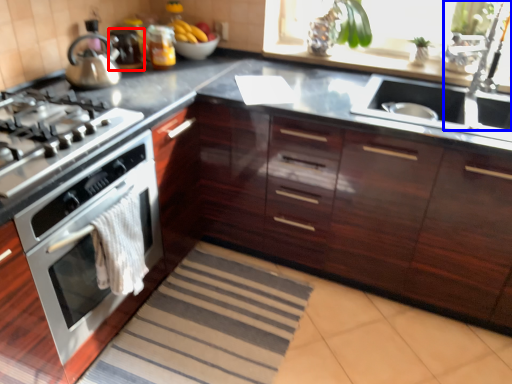
Question: Among these objects, which one is farthest to the camera, appliance (highlighted by a red box) or faucet (highlighted by a blue box)?

Choices:
 (A) appliance
 (B) faucet

Answer: (A)